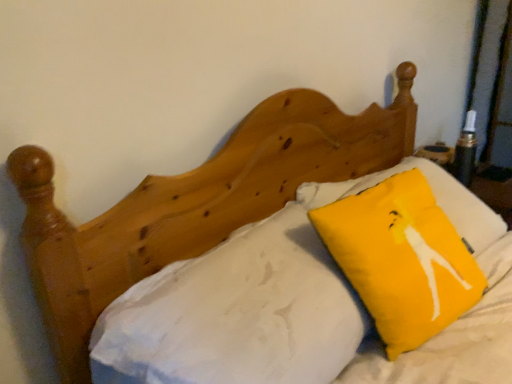
Question: Should I look upward or downward to see white cotton sheet at upper center?

Choices:
 (A) down
 (B) up

Answer: (A)

Question: From a real-world perspective, does yellow fabric pillow at upper right stand above white cotton sheet at upper center?

Choices:
 (A) yes
 (B) no

Answer: (A)

Question: Could you tell me if yellow fabric pillow at upper right is turned towards white cotton sheet at upper center?

Choices:
 (A) yes
 (B) no

Answer: (B)

Question: Is yellow fabric pillow at upper right not close to white cotton sheet at upper center?

Choices:
 (A) no
 (B) yes

Answer: (A)

Question: Can you confirm if yellow fabric pillow at upper right is shorter than white cotton sheet at upper center?

Choices:
 (A) yes
 (B) no

Answer: (A)

Question: Is yellow fabric pillow at upper right positioned behind white cotton sheet at upper center?

Choices:
 (A) no
 (B) yes

Answer: (B)

Question: Considering the relative positions of yellow fabric pillow at upper right and white cotton sheet at upper center in the image provided, is yellow fabric pillow at upper right to the left of white cotton sheet at upper center from the viewer's perspective?

Choices:
 (A) no
 (B) yes

Answer: (A)

Question: Considering the relative sizes of white cotton sheet at upper center and yellow fabric pillow at upper right in the image provided, is white cotton sheet at upper center bigger than yellow fabric pillow at upper right?

Choices:
 (A) no
 (B) yes

Answer: (B)

Question: Is yellow fabric pillow at upper right completely or partially inside white cotton sheet at upper center?

Choices:
 (A) yes
 (B) no

Answer: (B)

Question: Is the position of white cotton sheet at upper center more distant than that of yellow fabric pillow at upper right?

Choices:
 (A) yes
 (B) no

Answer: (B)

Question: Would you consider white cotton sheet at upper center to be distant from yellow fabric pillow at upper right?

Choices:
 (A) no
 (B) yes

Answer: (A)

Question: Does white cotton sheet at upper center appear on the left side of yellow fabric pillow at upper right?

Choices:
 (A) yes
 (B) no

Answer: (A)

Question: Is white cotton sheet at upper center thinner than yellow fabric pillow at upper right?

Choices:
 (A) no
 (B) yes

Answer: (A)

Question: Is point (458, 271) closer or farther from the camera than point (286, 223)?

Choices:
 (A) closer
 (B) farther

Answer: (A)